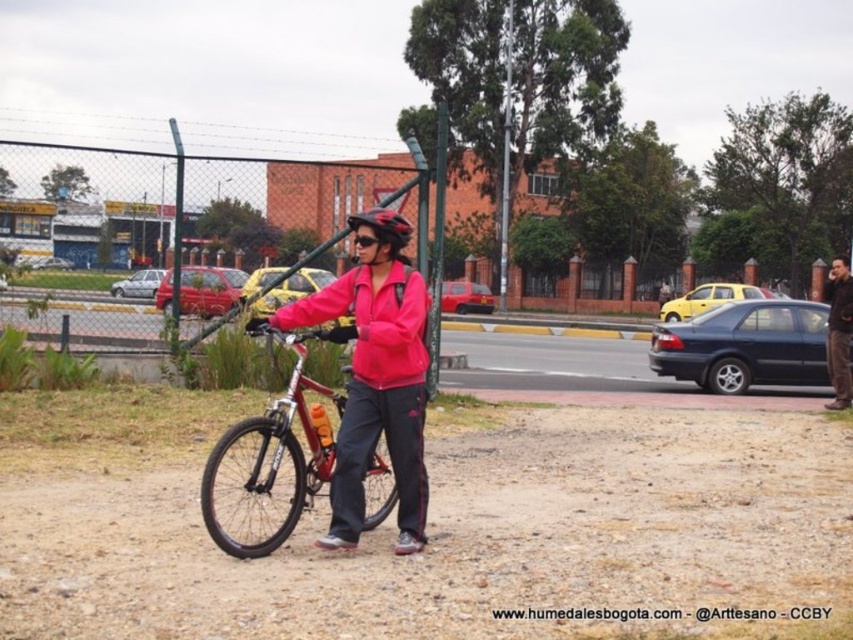
Who is taller, shiny metallic bicycle at center or matte pink jacket at center?

Standing taller between the two is shiny metallic bicycle at center.

This screenshot has height=640, width=853. Describe the element at coordinates (276, 452) in the screenshot. I see `shiny metallic bicycle at center` at that location.

Between point (310, 429) and point (372, 326), which one is positioned behind?

Positioned behind is point (310, 429).

At what (x,y) coordinates should I click in order to perform the action: click on shiny metallic bicycle at center. Please return your answer as a coordinate pair (x, y). Image resolution: width=853 pixels, height=640 pixels. Looking at the image, I should click on (276, 452).

Is the position of shiny metallic bicycle at center more distant than that of dark brown leather jacket at right?

No, shiny metallic bicycle at center is closer to the viewer.

Between point (291, 433) and point (842, 292), which one is positioned in front?

Positioned in front is point (291, 433).

At what (x,y) coordinates should I click in order to perform the action: click on shiny metallic bicycle at center. Please return your answer as a coordinate pair (x, y). The image size is (853, 640). Looking at the image, I should click on (276, 452).

Image resolution: width=853 pixels, height=640 pixels. What are the coordinates of `pink matte jacket at center` in the screenshot? It's located at (375, 376).

Does pink matte jacket at center appear over shiny black helmet at center?

Incorrect, pink matte jacket at center is not positioned above shiny black helmet at center.

Describe the element at coordinates (375, 376) in the screenshot. This screenshot has width=853, height=640. I see `pink matte jacket at center` at that location.

The height and width of the screenshot is (640, 853). What are the coordinates of `pink matte jacket at center` in the screenshot? It's located at (375, 376).